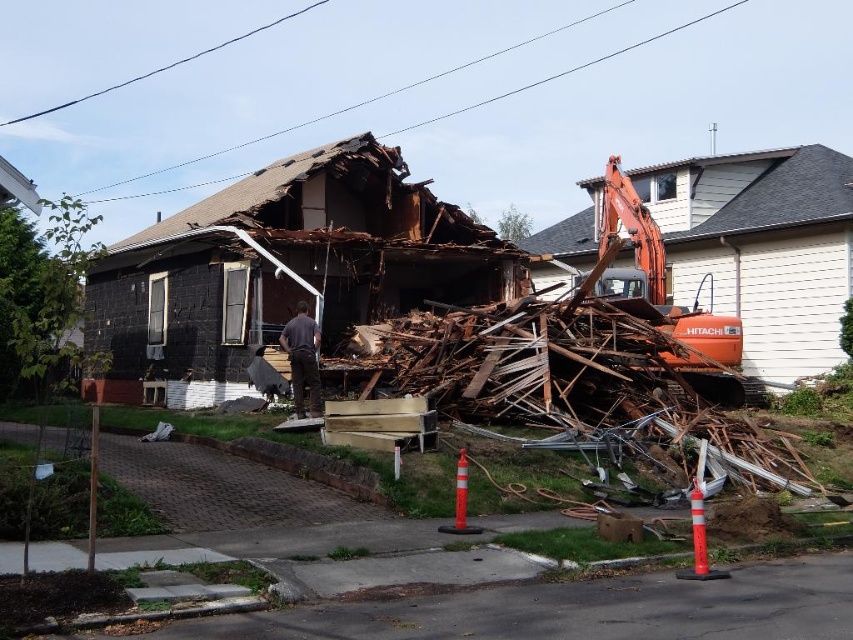
You are a construction worker standing near the demolished house. You notice the orange metallic excavator at center and the dark gray fabric at center. Which object is positioned higher in the scene?

The orange metallic excavator at center is above the dark gray fabric at center, so it is positioned higher in the scene.

You are a construction worker standing at the point marked by the coordinate point (665, 292). What object are you currently standing on?

The point (665, 292) marks the orange metallic excavator at center, so you are standing on the orange metallic excavator at center.